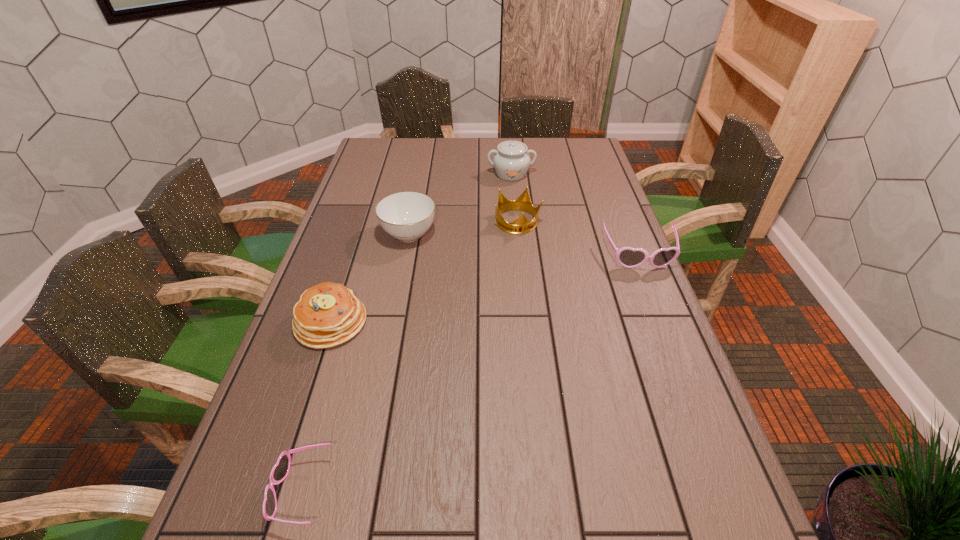
This screenshot has width=960, height=540. I want to click on free space that satisfies the following two spatial constraints: 1. on the front side of the tallest object; 2. on the front-facing side of the nearer sunglasses, so click(x=543, y=491).

Locate an element on the screen. This screenshot has width=960, height=540. free spot that satisfies the following two spatial constraints: 1. on the front side of the crown; 2. on the left side of the tallest object is located at coordinates (516, 222).